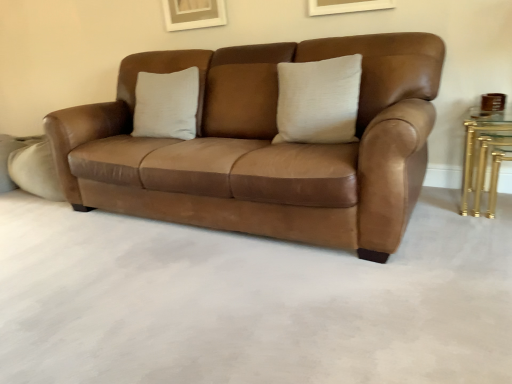
Question: From the image's perspective, does gold metallic table at right appear lower than satin beige pillow at center?

Choices:
 (A) no
 (B) yes

Answer: (B)

Question: From a real-world perspective, is gold metallic table at right on satin beige pillow at center?

Choices:
 (A) yes
 (B) no

Answer: (B)

Question: Considering the relative sizes of gold metallic table at right and satin beige pillow at center in the image provided, is gold metallic table at right bigger than satin beige pillow at center?

Choices:
 (A) no
 (B) yes

Answer: (A)

Question: Considering the relative sizes of gold metallic table at right and satin beige pillow at center in the image provided, is gold metallic table at right shorter than satin beige pillow at center?

Choices:
 (A) yes
 (B) no

Answer: (A)

Question: Can you confirm if gold metallic table at right is taller than satin beige pillow at center?

Choices:
 (A) no
 (B) yes

Answer: (A)

Question: Would you say satin beige pillow at center is to the left or to the right of suede leather couch at center in the picture?

Choices:
 (A) left
 (B) right

Answer: (B)

Question: From a real-world perspective, is satin beige pillow at center physically located above or below suede leather couch at center?

Choices:
 (A) above
 (B) below

Answer: (A)

Question: From the image's perspective, relative to suede leather couch at center, is satin beige pillow at center above or below?

Choices:
 (A) below
 (B) above

Answer: (B)

Question: Considering the positions of satin beige pillow at center and suede leather couch at center in the image, is satin beige pillow at center wider or thinner than suede leather couch at center?

Choices:
 (A) wide
 (B) thin

Answer: (B)

Question: Considering the positions of gold metallic table at right and suede leather couch at center in the image, is gold metallic table at right bigger or smaller than suede leather couch at center?

Choices:
 (A) small
 (B) big

Answer: (A)

Question: Is gold metallic table at right taller or shorter than suede leather couch at center?

Choices:
 (A) short
 (B) tall

Answer: (A)

Question: Considering their positions, is gold metallic table at right located in front of or behind suede leather couch at center?

Choices:
 (A) front
 (B) behind

Answer: (B)

Question: Is gold metallic table at right to the left or to the right of suede leather couch at center in the image?

Choices:
 (A) left
 (B) right

Answer: (B)

Question: From a real-world perspective, is suede leather couch at center physically located above or below satin beige pillow at center?

Choices:
 (A) above
 (B) below

Answer: (B)

Question: Is suede leather couch at center situated inside satin beige pillow at center or outside?

Choices:
 (A) inside
 (B) outside

Answer: (B)